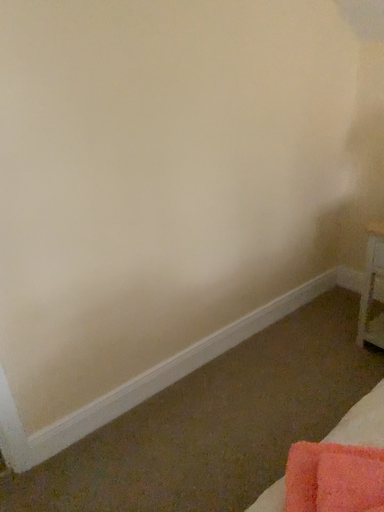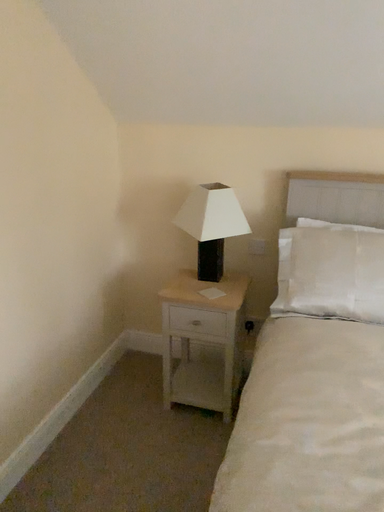
Question: Which way did the camera rotate in the video?

Choices:
 (A) rotated downward
 (B) rotated upward

Answer: (B)